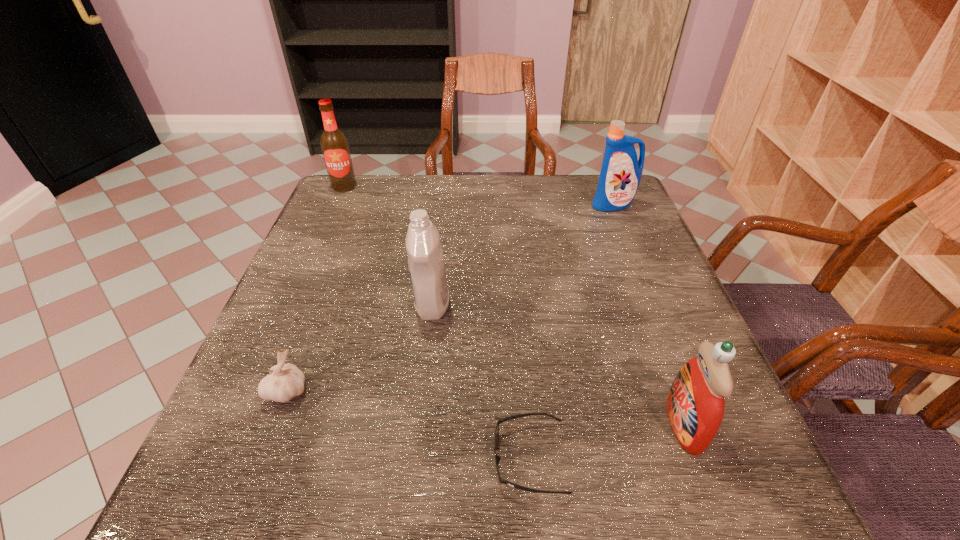
This screenshot has height=540, width=960. I want to click on detergent at the near edge, so click(695, 404).

You are a GUI agent. You are given a task and a screenshot of the screen. Output one action in this format:
    pyautogui.click(x=<x>, y=<y>)
    Task: Click on the sunglasses that is at the near edge
    The width and height of the screenshot is (960, 540).
    Given the screenshot: What is the action you would take?
    pyautogui.click(x=497, y=458)

Find the location of a particular element. The width and height of the screenshot is (960, 540). beer bottle that is at the left edge is located at coordinates (335, 148).

In order to click on garlic situated at the left edge in this screenshot , I will do `click(285, 381)`.

Identify the location of object that is at the far left corner. Image resolution: width=960 pixels, height=540 pixels. (335, 148).

The image size is (960, 540). I want to click on object present at the far right corner, so click(621, 172).

This screenshot has width=960, height=540. I want to click on object present at the near right corner, so click(695, 404).

The image size is (960, 540). What are the coordinates of `free space at the far edge of the desktop` in the screenshot? It's located at (462, 209).

Image resolution: width=960 pixels, height=540 pixels. Identify the location of vacant position at the near edge of the desktop. [x=384, y=464].

The image size is (960, 540). What are the coordinates of `free region at the left edge` in the screenshot? It's located at (316, 395).